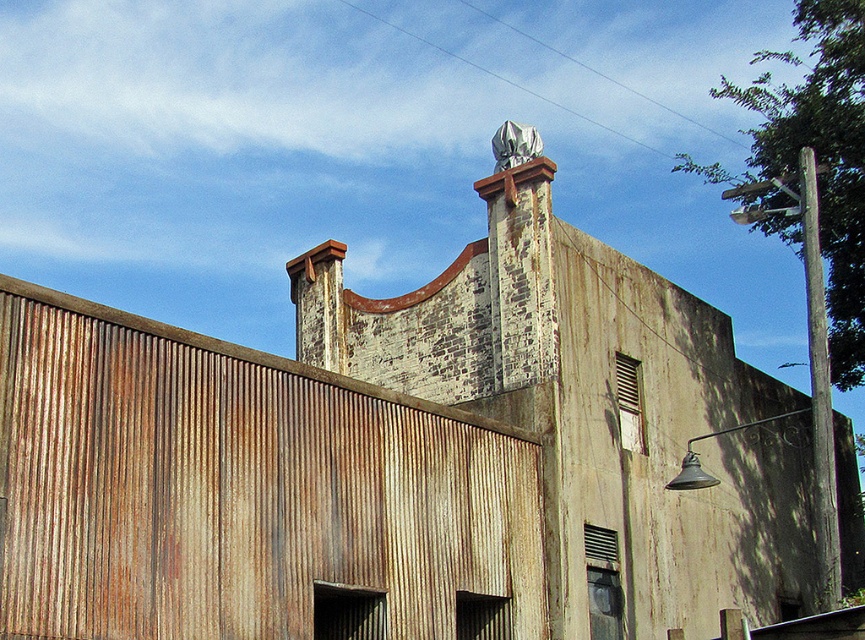
Does rusty corrugated metal at center have a greater width compared to white stone chimney at upper center?

Incorrect, rusty corrugated metal at center's width does not surpass white stone chimney at upper center's.

Who is positioned more to the right, rusty corrugated metal at center or white stone chimney at upper center?

white stone chimney at upper center

Who is more distant from viewer, (x=61, y=493) or (x=753, y=602)?

Positioned behind is point (x=753, y=602).

I want to click on rusty corrugated metal at center, so click(x=244, y=492).